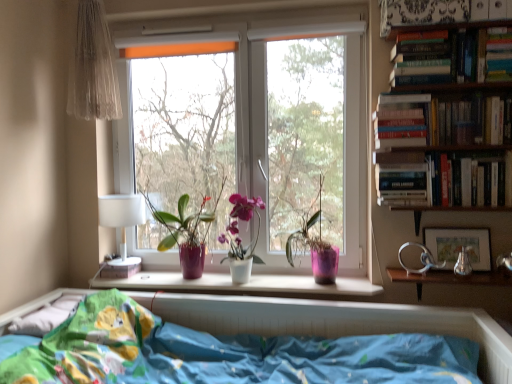
Locate an element on the screen. The height and width of the screenshot is (384, 512). free location above hardcover books at upper right, arranged as the second book when ordered from the bottom (from a real-world perspective) is located at coordinates (464, 95).